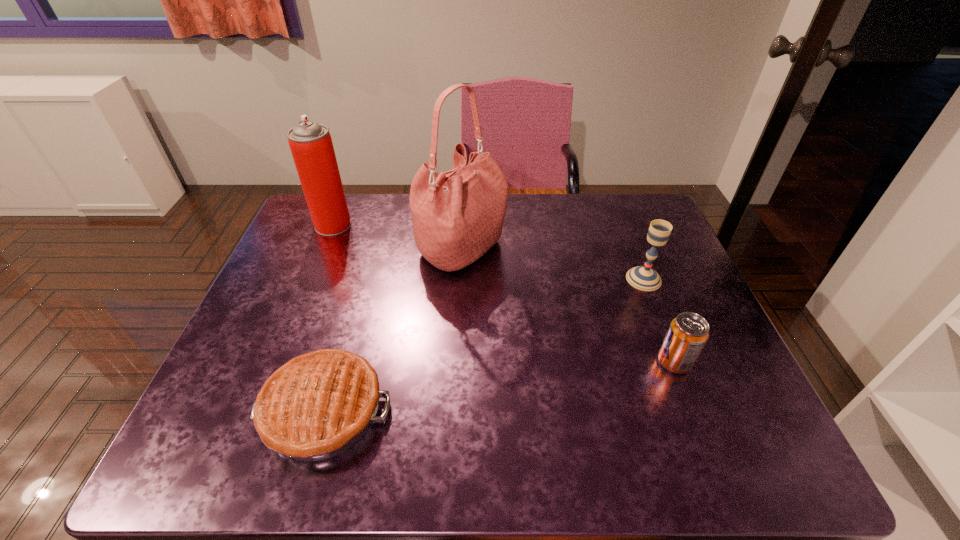
Identify the location of handbag. (458, 215).

Where is `the tallest object`? the tallest object is located at coordinates (458, 215).

Locate an element on the screen. The height and width of the screenshot is (540, 960). the fourth shortest object is located at coordinates (311, 145).

Find the location of a particular element. chalice is located at coordinates (645, 278).

You are a GUI agent. You are given a task and a screenshot of the screen. Output one action in this format:
    pyautogui.click(x=<x>, y=<y>)
    Task: Click on the soda can
    
    Given the screenshot: What is the action you would take?
    pyautogui.click(x=688, y=333)

What are the coordinates of `pie` in the screenshot? It's located at (317, 405).

This screenshot has height=540, width=960. What are the coordinates of `vacant space located on the left of the tallest object` in the screenshot? It's located at (396, 250).

Identify the location of free location located 0.240m on the front of the aerosol can. (305, 293).

The height and width of the screenshot is (540, 960). Identify the location of vacant point located 0.240m on the front of the third shortest object. (679, 368).

Where is `free region located 0.340m on the left of the second shortest object`? free region located 0.340m on the left of the second shortest object is located at coordinates (505, 361).